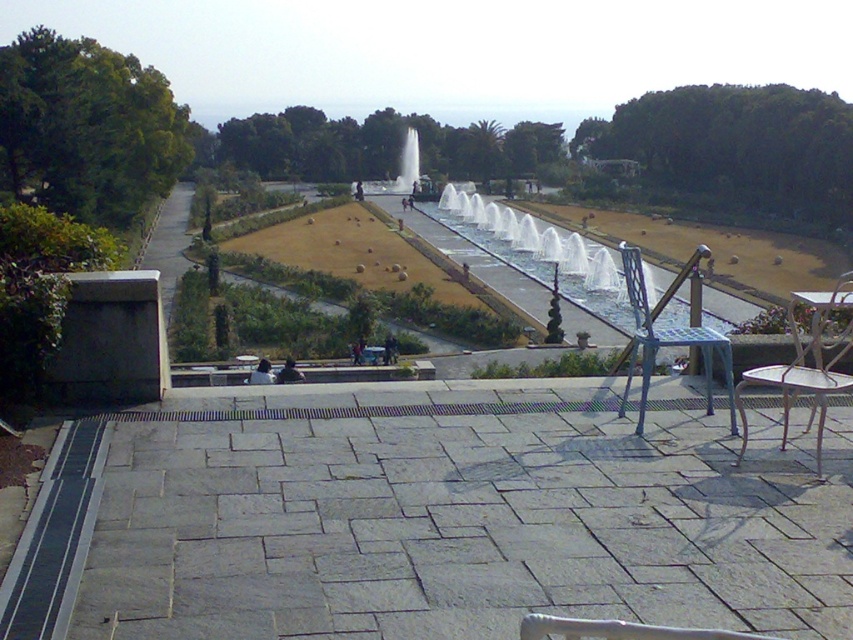
Question: Which of the following is the closest to the observer?

Choices:
 (A) (549, 250)
 (B) (641, 312)
 (C) (798, 385)

Answer: (C)

Question: Can you confirm if clear glass water at center is positioned above metallic blue chair at right?

Choices:
 (A) yes
 (B) no

Answer: (A)

Question: Does clear glass water at center have a larger size compared to metallic blue chair at right?

Choices:
 (A) yes
 (B) no

Answer: (A)

Question: Which object appears farthest from the camera in this image?

Choices:
 (A) clear glass water at center
 (B) metallic white chair at lower right
 (C) metallic blue chair at right

Answer: (A)

Question: Can you confirm if clear glass water at center is thinner than metallic white chair at lower right?

Choices:
 (A) no
 (B) yes

Answer: (B)

Question: Which of the following is the farthest from the observer?

Choices:
 (A) clear glass water at center
 (B) metallic white chair at lower right

Answer: (A)